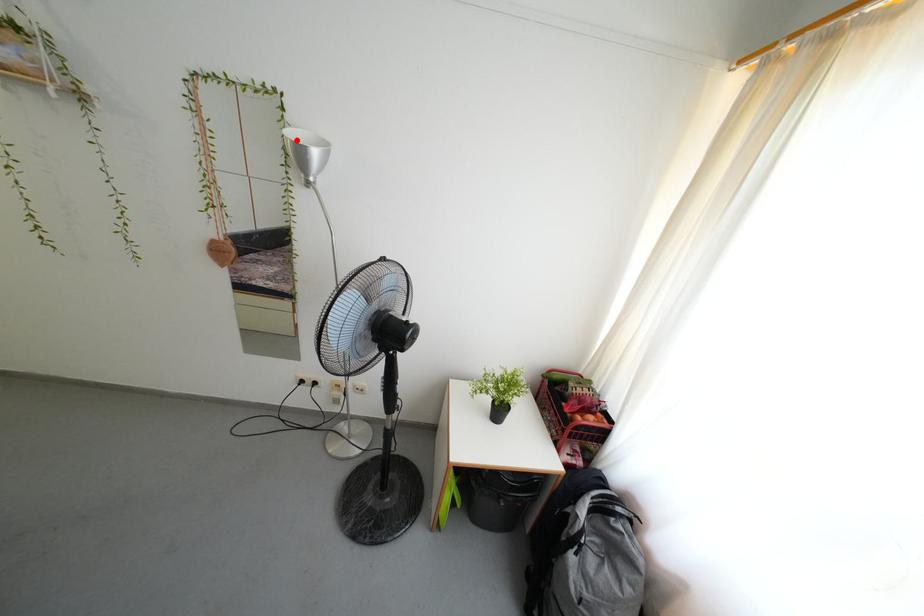
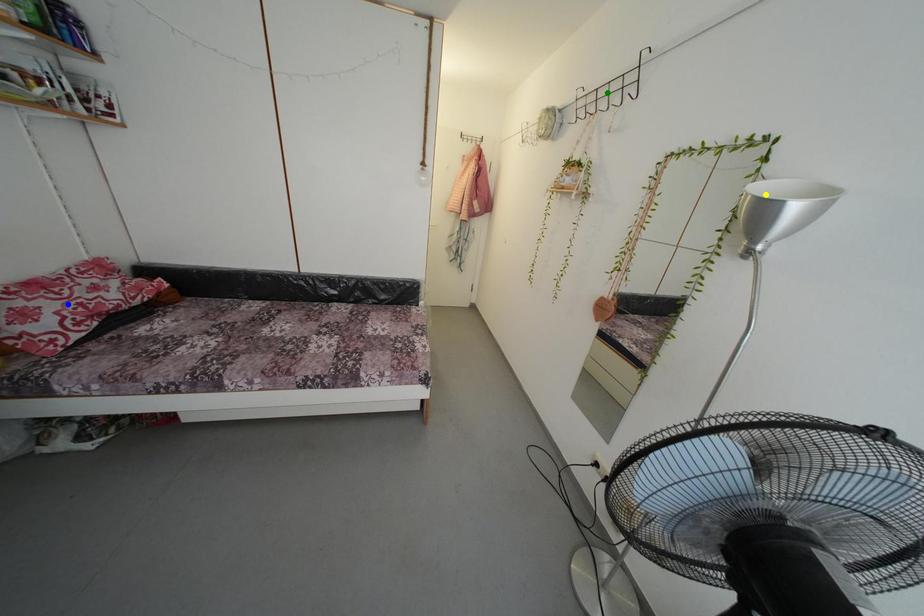
Question: I am providing you with two images of the same scene from different viewpoints. A red point is marked on the first image. You are given multiple points on the second image. Which spot in image 2 lines up with the point in image 1?

Choices:
 (A) blue point
 (B) green point
 (C) yellow point

Answer: (C)